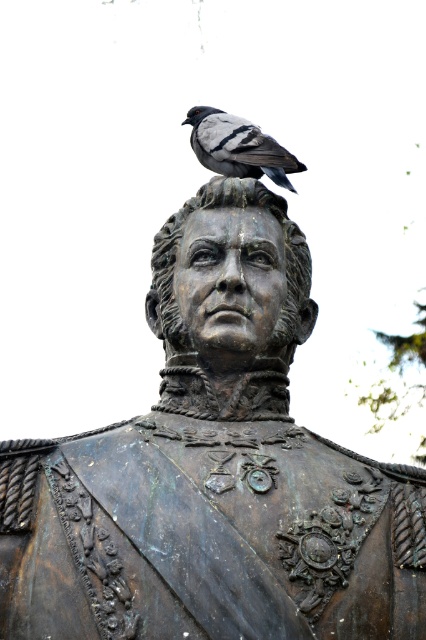
You are a birdwatcher observing the bronze statue head at center and the gray feathered pigeon at center. Which object is larger in size?

The bronze statue head at center has a smaller size compared to the gray feathered pigeon at center, so the gray feathered pigeon at center is larger.

You are standing in front of the statue and want to take a photo of it. If your camera has a sensor that can only capture objects within a 0.6 to 0.65 coordinate range on the horizontal axis, will the bronze statue at upper center be fully visible in the photo?

The bronze statue at upper center is positioned at 0.738 on the horizontal axis, which is outside the camera sensor range of 0.6 to 0.65. Therefore, the statue will not be fully visible in the photo.

You are a photographer trying to capture the bronze statue at upper center and the bronze statue head at center in a single shot. However, you notice that one of them is blocking the other. Which part of the statue is obstructing the view of the other?

The bronze statue at upper center is in front of the bronze statue head at center, so the bronze statue at upper center is blocking the view of the bronze statue head at center.